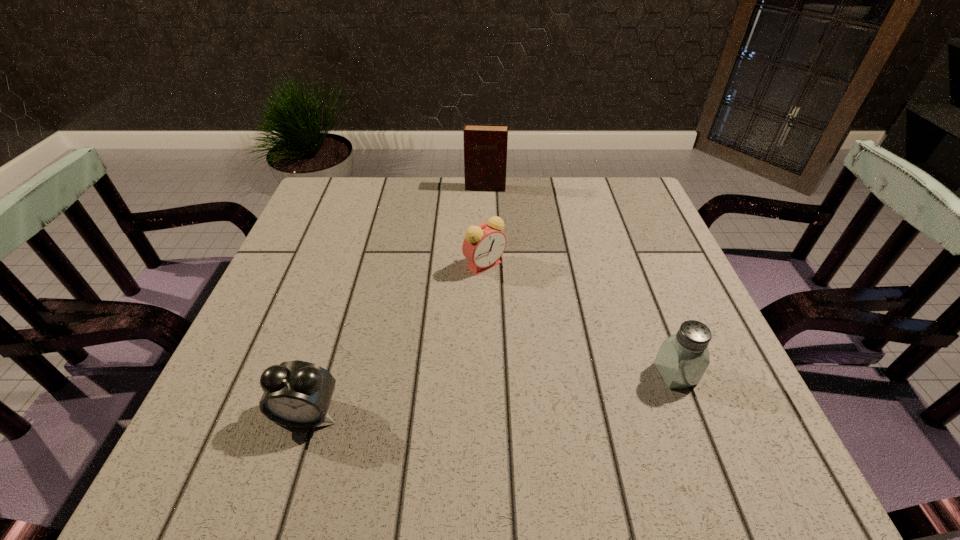
At what (x,y) coordinates should I click in order to perform the action: click on vacant space located 0.210m on the face of the right alarm clock. Please return your answer as a coordinate pair (x, y). Looking at the image, I should click on (478, 353).

Image resolution: width=960 pixels, height=540 pixels. Find the location of `vacant space located 0.340m on the face of the right alarm clock`. vacant space located 0.340m on the face of the right alarm clock is located at coordinates (474, 416).

This screenshot has height=540, width=960. I want to click on vacant space located on the front cover of the diary, so click(x=479, y=235).

You are a GUI agent. You are given a task and a screenshot of the screen. Output one action in this format:
    pyautogui.click(x=<x>, y=<y>)
    Task: Click on the free spot located on the front cover of the diary
    Image resolution: width=960 pixels, height=540 pixels.
    Given the screenshot: What is the action you would take?
    pyautogui.click(x=474, y=279)

This screenshot has height=540, width=960. What are the coordinates of `vacant area located 0.240m on the front cover of the diary` in the screenshot? It's located at (478, 245).

Locate an element on the screen. The height and width of the screenshot is (540, 960). object that is at the far edge is located at coordinates (485, 145).

Find the location of `alarm clock at the near edge`. alarm clock at the near edge is located at coordinates (297, 394).

This screenshot has height=540, width=960. I want to click on saltshaker at the near edge, so click(683, 358).

Locate an element on the screen. The width and height of the screenshot is (960, 540). object located in the left edge section of the desktop is located at coordinates (297, 394).

Find the location of `object situated at the right edge`. object situated at the right edge is located at coordinates (683, 358).